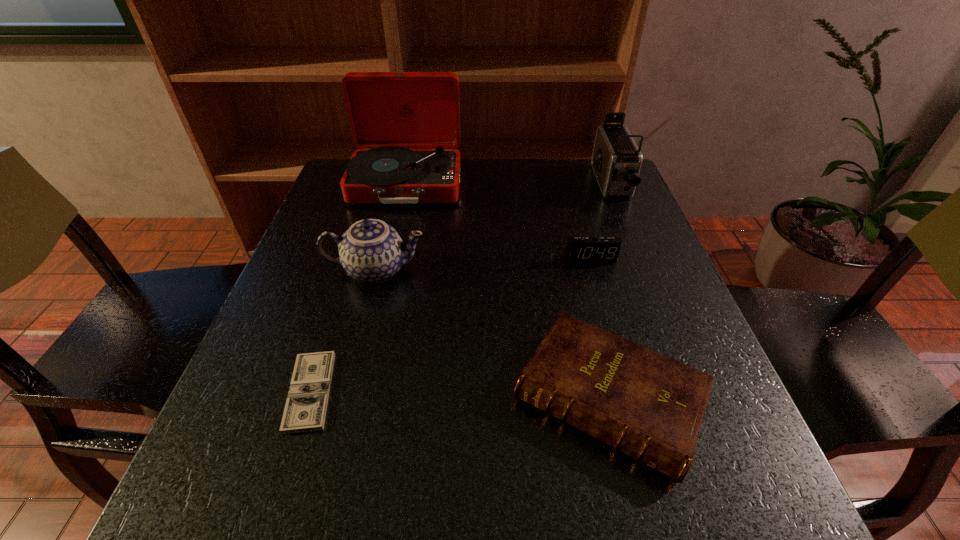
I want to click on free spot located 0.280m on the back of the hardback book, so click(570, 238).

Locate an element on the screen. The image size is (960, 540). vacant region located on the right of the dollar is located at coordinates (516, 391).

You are a GUI agent. You are given a task and a screenshot of the screen. Output one action in this format:
    pyautogui.click(x=<x>, y=<y>)
    Task: Click on the phonograph_record present at the far edge
    The image size is (960, 540).
    Given the screenshot: What is the action you would take?
    pyautogui.click(x=407, y=124)

Identify the location of camcorder at the far edge. (616, 160).

Where is `object present at the near edge`? The image size is (960, 540). object present at the near edge is located at coordinates (648, 406).

Identify the location of phonograph_record situated at the left edge. This screenshot has height=540, width=960. (407, 124).

The width and height of the screenshot is (960, 540). In order to click on chinaware located in the left edge section of the desktop in this screenshot , I will do `click(371, 251)`.

Where is `dollar located at the left edge`? Image resolution: width=960 pixels, height=540 pixels. dollar located at the left edge is located at coordinates (305, 409).

The image size is (960, 540). In order to click on camcorder that is at the right edge in this screenshot , I will do `click(616, 160)`.

Locate an element on the screen. alarm clock that is at the right edge is located at coordinates (579, 249).